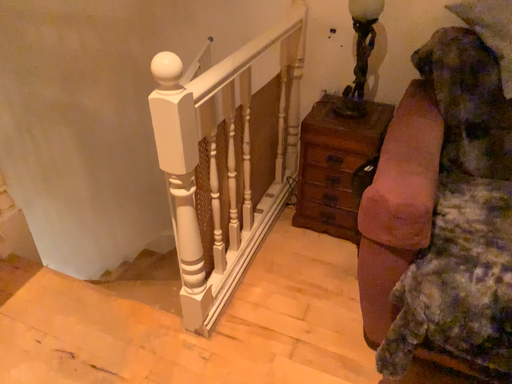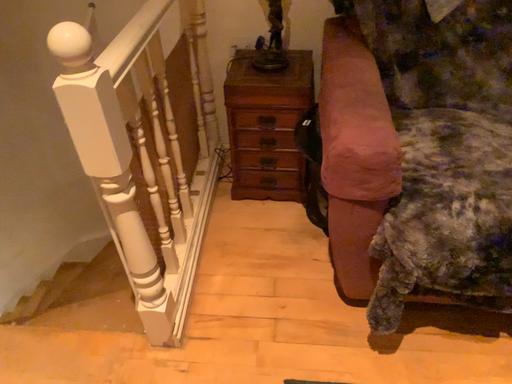
Question: Which way did the camera rotate in the video?

Choices:
 (A) rotated left
 (B) rotated right

Answer: (B)